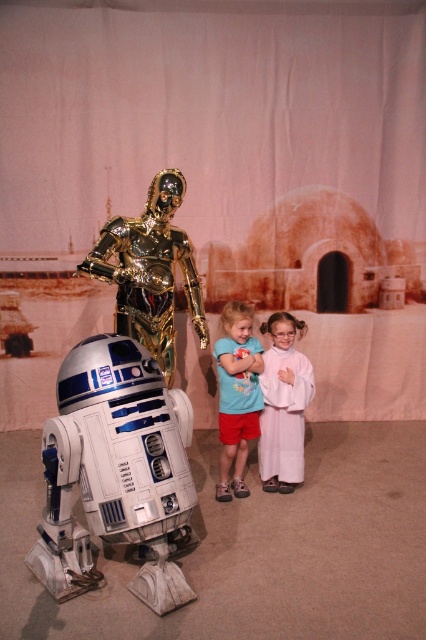
You are a fashion designer observing the image. You need to decide which clothing item is shorter between the white satin dress at center and the blue cotton shirt at center. Which one is shorter?

The white satin dress at center is shorter than the blue cotton shirt at center.

You are standing at point (236, 349) and want to move to the right side of the image. Which direction should you move to reach the point (299, 445) without passing through the white and blue droid resembling R2D2?

Point (299, 445) is behind point (236, 349), so you should move backward to reach it without passing through the droid.